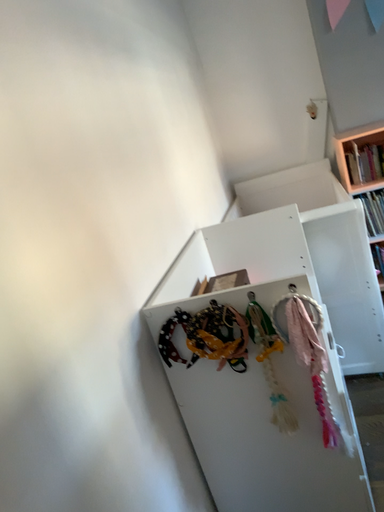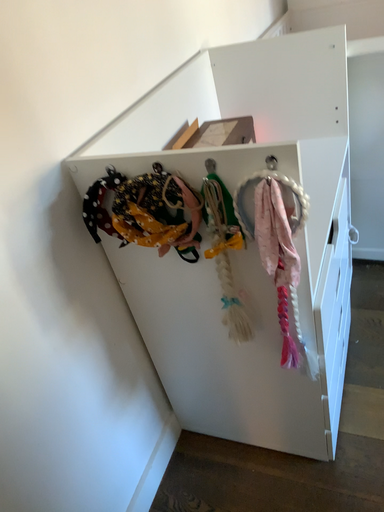
Question: Which way did the camera rotate in the video?

Choices:
 (A) rotated left
 (B) rotated right

Answer: (A)